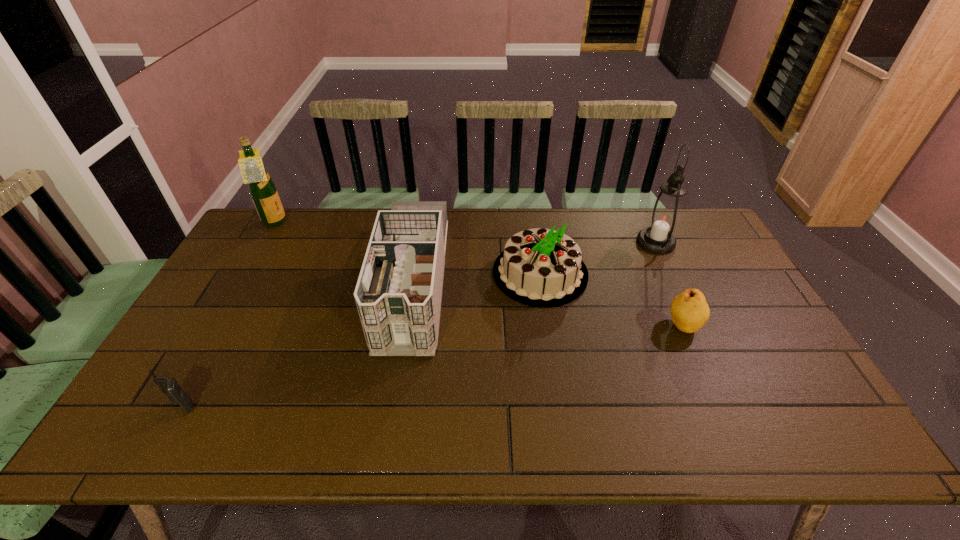
The height and width of the screenshot is (540, 960). I want to click on empty space that is in between the oil lamp and the pear, so click(x=669, y=284).

Where is `unoccupied position between the cellular telephone and the third object from left to right`? This screenshot has height=540, width=960. unoccupied position between the cellular telephone and the third object from left to right is located at coordinates [x=298, y=345].

At what (x,y) coordinates should I click in order to perform the action: click on vacant space that's between the fourth object from left to right and the nearest object. Please return your answer as a coordinate pair (x, y). Looking at the image, I should click on (362, 340).

Select which object is the closest to the oil lamp. Please provide its 2D coordinates. Your answer should be formatted as a tuple, i.e. [(x, y)], where the tuple contains the x and y coordinates of a point satisfying the conditions above.

[(539, 267)]

Choose which object is the nearest neighbor to the cellular telephone. Please provide its 2D coordinates. Your answer should be formatted as a tuple, i.e. [(x, y)], where the tuple contains the x and y coordinates of a point satisfying the conditions above.

[(398, 294)]

Identify the location of vacant space that satisfies the following two spatial constraints: 1. on the back side of the oil lamp; 2. on the left side of the third object from right to left. (536, 242).

Where is `blank area in the image that satisfies the following two spatial constraints: 1. on the back side of the pear; 2. on the front-facing side of the liquor`? blank area in the image that satisfies the following two spatial constraints: 1. on the back side of the pear; 2. on the front-facing side of the liquor is located at coordinates 637,223.